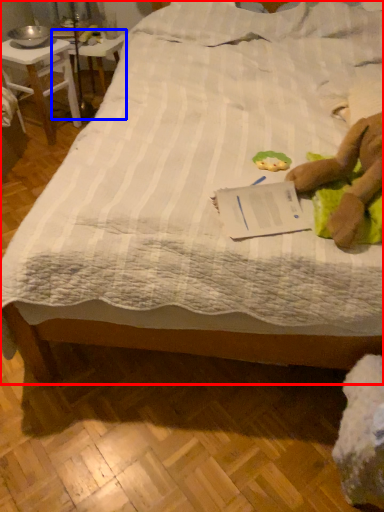
Question: Which object is closer to the camera taking this photo, bed (highlighted by a red box) or table (highlighted by a blue box)?

Choices:
 (A) bed
 (B) table

Answer: (A)